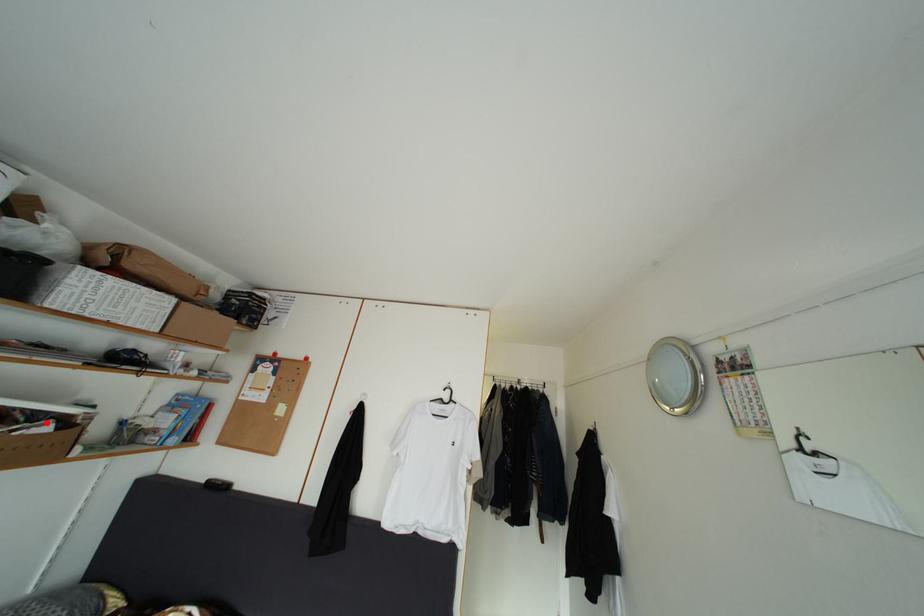
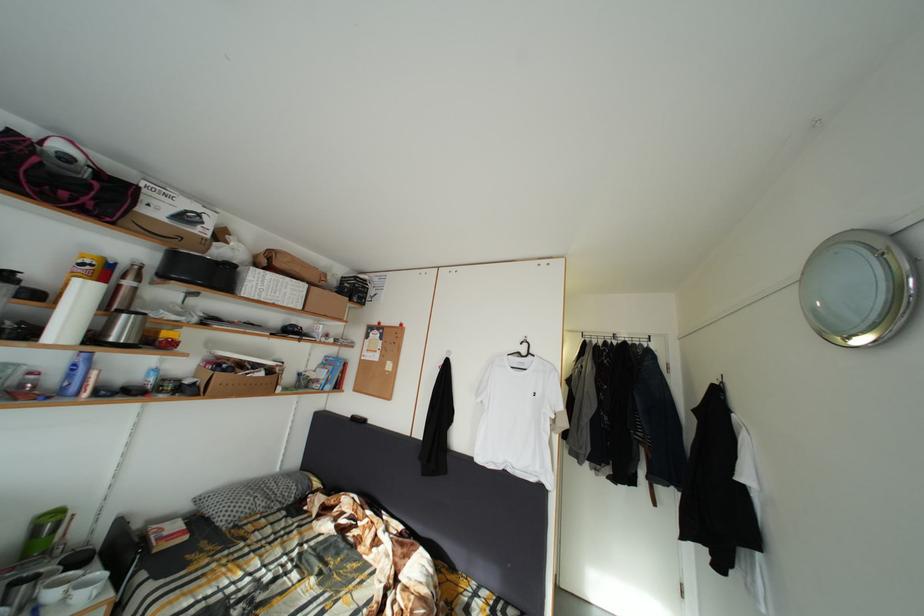
Where in the second image is the point corresponding to the highlighted location from the first image?

(264, 373)